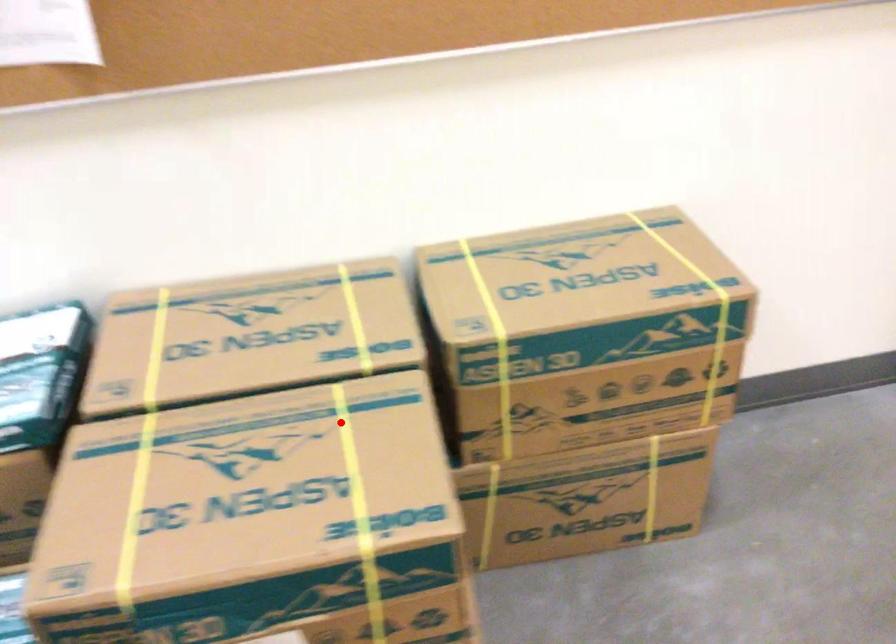
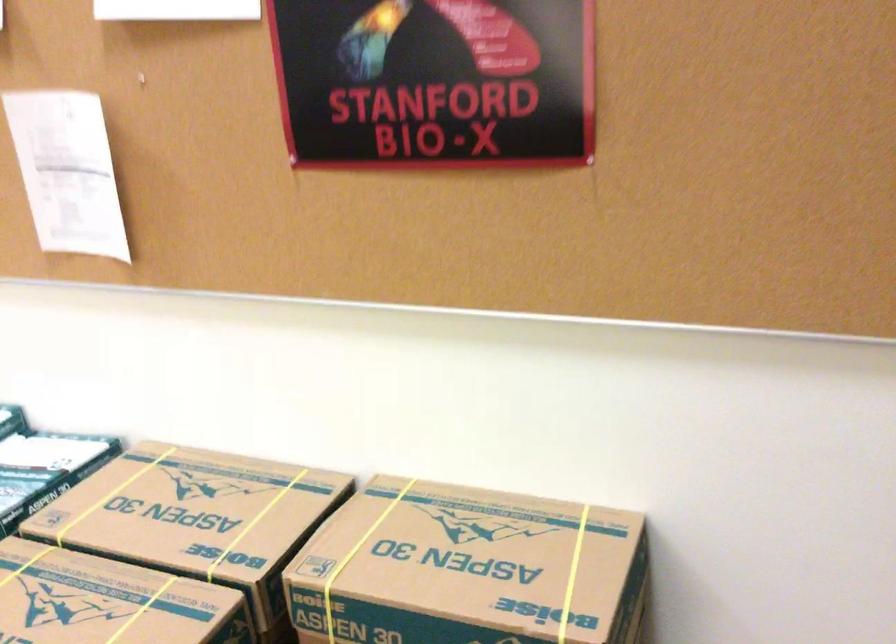
The point at the highlighted location is marked in the first image. Where is the corresponding point in the second image?

(142, 609)